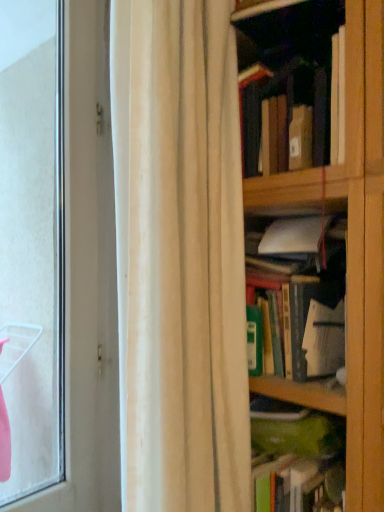
Question: From the image's perspective, is hardcover book at upper right, marked as the 3th book in a bottom-to-top arrangement, beneath white fabric curtain at center?

Choices:
 (A) no
 (B) yes

Answer: (A)

Question: Is hardcover book at upper right, which is the first book from top to bottom, far from white fabric curtain at center?

Choices:
 (A) no
 (B) yes

Answer: (A)

Question: Could you tell me if hardcover book at upper right, marked as the 3th book in a bottom-to-top arrangement, is turned towards white fabric curtain at center?

Choices:
 (A) no
 (B) yes

Answer: (B)

Question: Does hardcover book at upper right, marked as the 3th book in a bottom-to-top arrangement, appear on the right side of white fabric curtain at center?

Choices:
 (A) yes
 (B) no

Answer: (A)

Question: Is hardcover book at upper right, marked as the 3th book in a bottom-to-top arrangement, completely or partially outside of white fabric curtain at center?

Choices:
 (A) no
 (B) yes

Answer: (B)

Question: Is transparent glass window at left in front of or behind white fabric curtain at center in the image?

Choices:
 (A) front
 (B) behind

Answer: (B)

Question: In terms of width, does transparent glass window at left look wider or thinner when compared to white fabric curtain at center?

Choices:
 (A) wide
 (B) thin

Answer: (B)

Question: Considering the positions of transparent glass window at left and white fabric curtain at center in the image, is transparent glass window at left bigger or smaller than white fabric curtain at center?

Choices:
 (A) big
 (B) small

Answer: (B)

Question: In the image, is transparent glass window at left on the left side or the right side of white fabric curtain at center?

Choices:
 (A) right
 (B) left

Answer: (B)

Question: Is hardcover book at upper right, which is the first book from top to bottom, inside the boundaries of green matte book at center, the 1th book from the bottom, or outside?

Choices:
 (A) inside
 (B) outside

Answer: (B)

Question: From a real-world perspective, relative to green matte book at center, which ranks as the 3th book in top-to-bottom order, is hardcover book at upper right, which is the first book from top to bottom, vertically above or below?

Choices:
 (A) below
 (B) above

Answer: (B)

Question: From the image's perspective, is hardcover book at upper right, marked as the 3th book in a bottom-to-top arrangement, above or below green matte book at center, which ranks as the 3th book in top-to-bottom order?

Choices:
 (A) above
 (B) below

Answer: (A)

Question: Is hardcover book at upper right, which is the first book from top to bottom, taller or shorter than green matte book at center, which ranks as the 3th book in top-to-bottom order?

Choices:
 (A) short
 (B) tall

Answer: (B)

Question: In the image, is green matte book at center, which appears as the 2th book when viewed from the top, positioned in front of or behind transparent glass window at left?

Choices:
 (A) front
 (B) behind

Answer: (A)

Question: In terms of height, does green matte book at center, which appears as the 2th book when viewed from the top, look taller or shorter compared to transparent glass window at left?

Choices:
 (A) tall
 (B) short

Answer: (B)